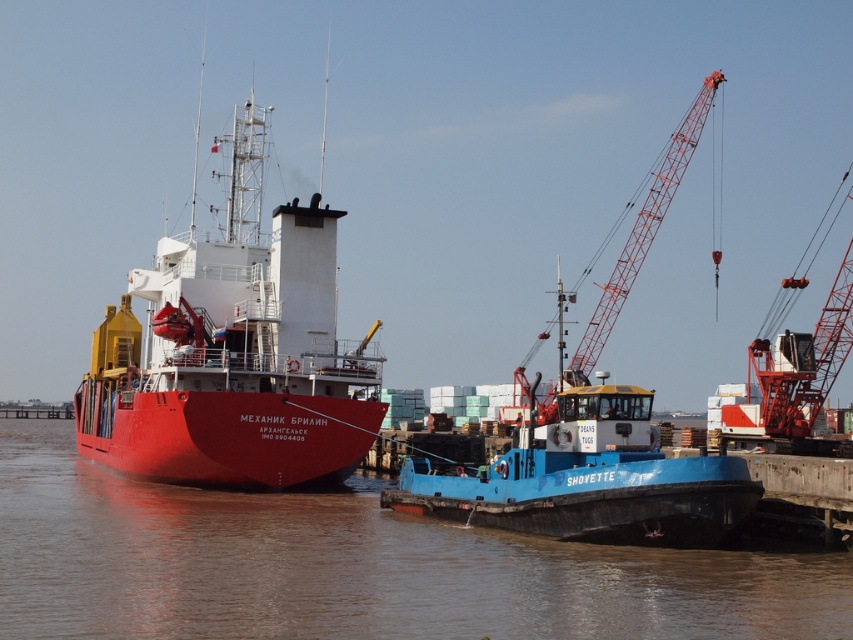
You are standing at the point marked as point [100,540] in the image. The red cargo ship named

The point [100,540] is 80.40 meters away from the viewer, so the distance between the viewer and the point is 80.40 meters.

Consider the image. You are a sailor on the shiny red ship at center. You want to jump into the brown matte water at lower left. Is the water level low enough for you to jump safely?

The brown matte water at lower left is shorter than the shiny red ship at center, so the water level might be too low for a safe jump. Check the depth before jumping.